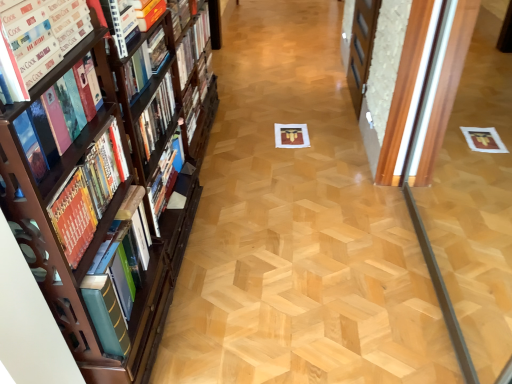
Question: In terms of width, does hardcover book at left, placed as the 3th book when sorted from front to back, look wider or thinner when compared to wooden screen door at right?

Choices:
 (A) thin
 (B) wide

Answer: (B)

Question: Is point (45, 109) closer or farther from the camera than point (353, 26)?

Choices:
 (A) closer
 (B) farther

Answer: (A)

Question: Which object is the closest to the hardcover book at upper left, the second book positioned from the back?

Choices:
 (A) hardcover book at upper center, acting as the 6th book starting from the front
 (B) matte hardcover book at left, which is the second book in front-to-back order
 (C) hardcover book at left, the third book viewed from the back
 (D) hardcover book at left, which is the 6th book from back to front
 (E) hardcover book at left, which is counted as the 4th book, starting from the back

Answer: (D)

Question: Based on their relative distances, which object is nearer to the hardcover book at left, which is counted as the 4th book, starting from the back?

Choices:
 (A) hardcover book at left, the third book viewed from the back
 (B) hardcover book at left, which is the 6th book from back to front
 (C) hardcover book at upper center, positioned as the first book in back-to-front order
 (D) matte hardcover book at left, which is the second book in front-to-back order
 (E) hardcover book at upper left, positioned as the fifth book in front-to-back order

Answer: (D)